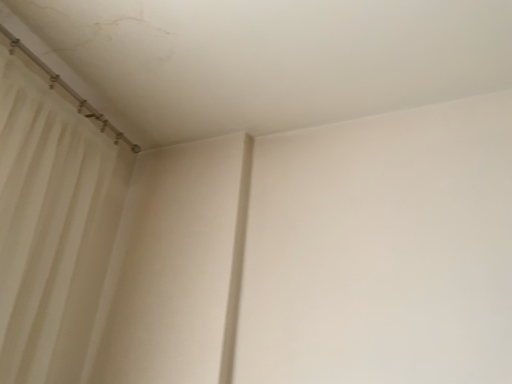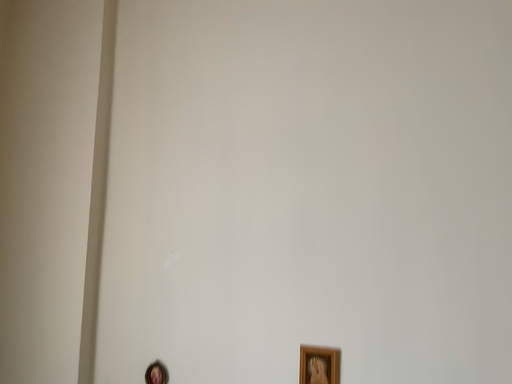
Question: Which way did the camera rotate in the video?

Choices:
 (A) rotated left
 (B) rotated right

Answer: (B)